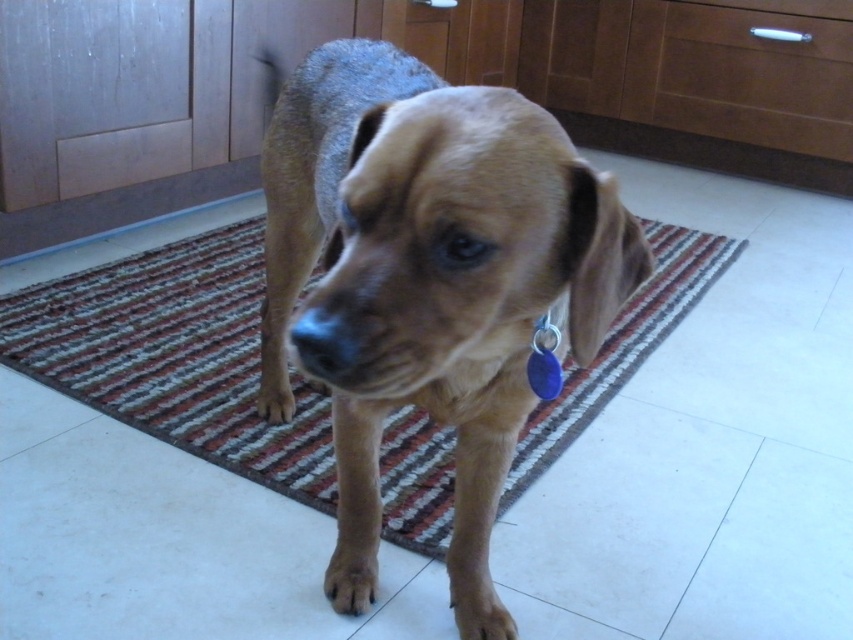
Can you confirm if brown matte dog at center is bigger than brown striped rug at center?

No.

Which is behind, point (366, 500) or point (86, 312)?

The point (86, 312) is behind.

Between point (577, 243) and point (44, 376), which one is positioned behind?

The point (44, 376) is behind.

At what (x,y) coordinates should I click in order to perform the action: click on brown matte dog at center. Please return your answer as a coordinate pair (x, y). Image resolution: width=853 pixels, height=640 pixels. Looking at the image, I should click on (426, 280).